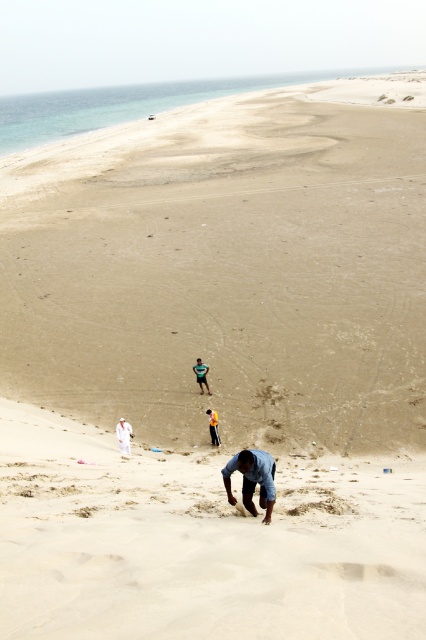
Between point (201, 636) and point (215, 419), which one is positioned behind?

Point (215, 419)

Does fine-grained sand at lower center have a larger size compared to yellow fabric person at center?

Correct, fine-grained sand at lower center is larger in size than yellow fabric person at center.

At what (x,y) coordinates should I click in order to perform the action: click on fine-grained sand at lower center. Please return your answer as a coordinate pair (x, y). Looking at the image, I should click on (199, 541).

The height and width of the screenshot is (640, 426). I want to click on fine-grained sand at lower center, so click(x=199, y=541).

Is blue denim jeans at lower center further to camera compared to blue denim shorts at center?

No, blue denim jeans at lower center is in front of blue denim shorts at center.

Can you confirm if blue denim jeans at lower center is positioned below blue denim shorts at center?

Indeed, blue denim jeans at lower center is positioned under blue denim shorts at center.

Between point (273, 486) and point (195, 376), which one is positioned in front?

Point (273, 486) is more forward.

Where is `blue denim jeans at lower center`? Image resolution: width=426 pixels, height=640 pixels. blue denim jeans at lower center is located at coordinates (253, 480).

Consider the image. Who is more forward, (201, 394) or (215, 422)?

Point (215, 422)

Is blue denim shorts at center shorter than yellow fabric person at center?

No, blue denim shorts at center is not shorter than yellow fabric person at center.

Who is more forward, (207, 392) or (218, 444)?

Positioned in front is point (218, 444).

I want to click on blue denim shorts at center, so pos(201,374).